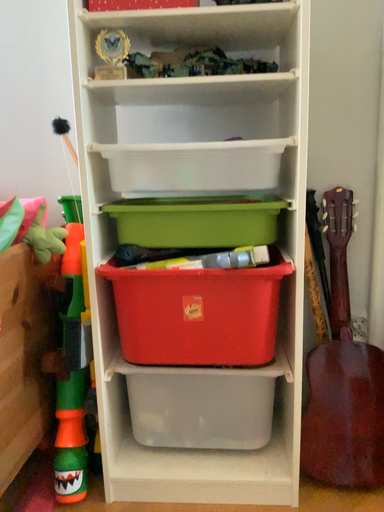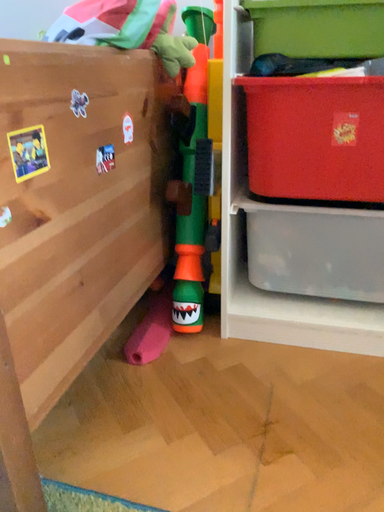
Question: Which way did the camera rotate in the video?

Choices:
 (A) rotated downward
 (B) rotated upward

Answer: (A)